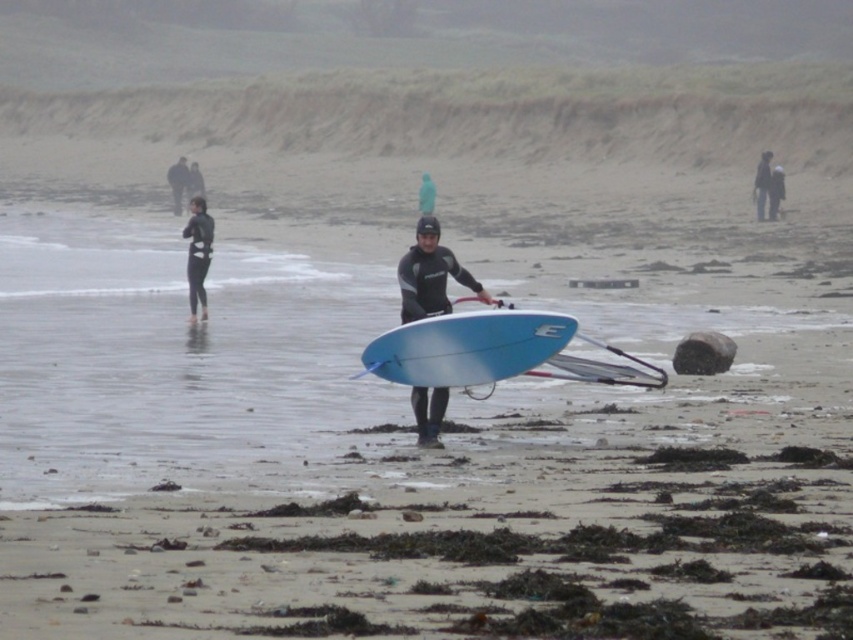
Can you confirm if blue matte surfboard at center is thinner than black wetsuit at left?

Incorrect, blue matte surfboard at center's width is not less than black wetsuit at left's.

This screenshot has width=853, height=640. I want to click on blue matte surfboard at center, so click(x=467, y=348).

Between blue matte surfboard at center and matte black wetsuit at center, which one appears on the left side from the viewer's perspective?

matte black wetsuit at center

Which is in front, point (415, 378) or point (427, 259)?

Point (415, 378) is more forward.

The height and width of the screenshot is (640, 853). I want to click on blue matte surfboard at center, so click(467, 348).

Between matte black wetsuit at center and black wetsuit at left, which one appears on the right side from the viewer's perspective?

From the viewer's perspective, matte black wetsuit at center appears more on the right side.

Is matte black wetsuit at center taller than black wetsuit at left?

No, matte black wetsuit at center is not taller than black wetsuit at left.

This screenshot has width=853, height=640. What do you see at coordinates (430, 275) in the screenshot?
I see `matte black wetsuit at center` at bounding box center [430, 275].

You are a GUI agent. You are given a task and a screenshot of the screen. Output one action in this format:
    pyautogui.click(x=<x>, y=<y>)
    Task: Click on the matte black wetsuit at center
    The width and height of the screenshot is (853, 640).
    Given the screenshot: What is the action you would take?
    pyautogui.click(x=430, y=275)